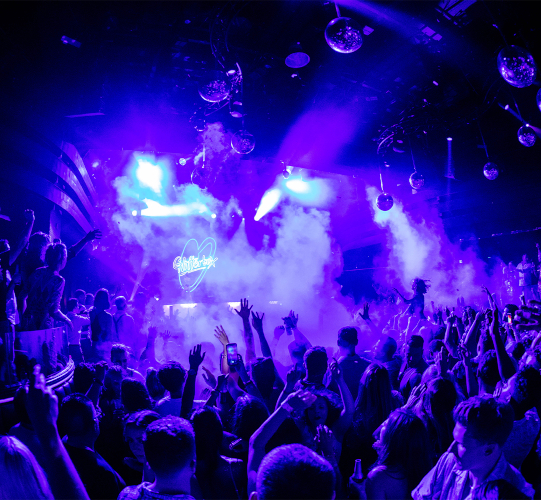
Where is `led`? Image resolution: width=541 pixels, height=500 pixels. led is located at coordinates (184, 269).